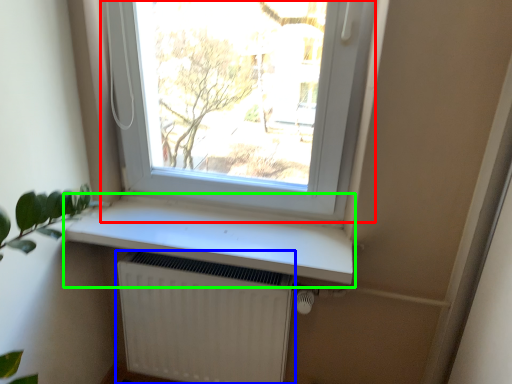
Question: Estimate the real-world distances between objects in this image. Which object is closer to window (highlighted by a red box), radiator (highlighted by a blue box) or window sill (highlighted by a green box)?

Choices:
 (A) radiator
 (B) window sill

Answer: (B)